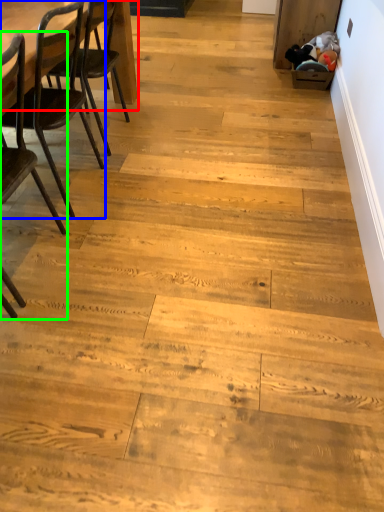
Question: Which object is positioned farthest from table (highlighted by a red box)? Select from chair (highlighted by a blue box) and chair (highlighted by a green box).

Choices:
 (A) chair
 (B) chair

Answer: (B)